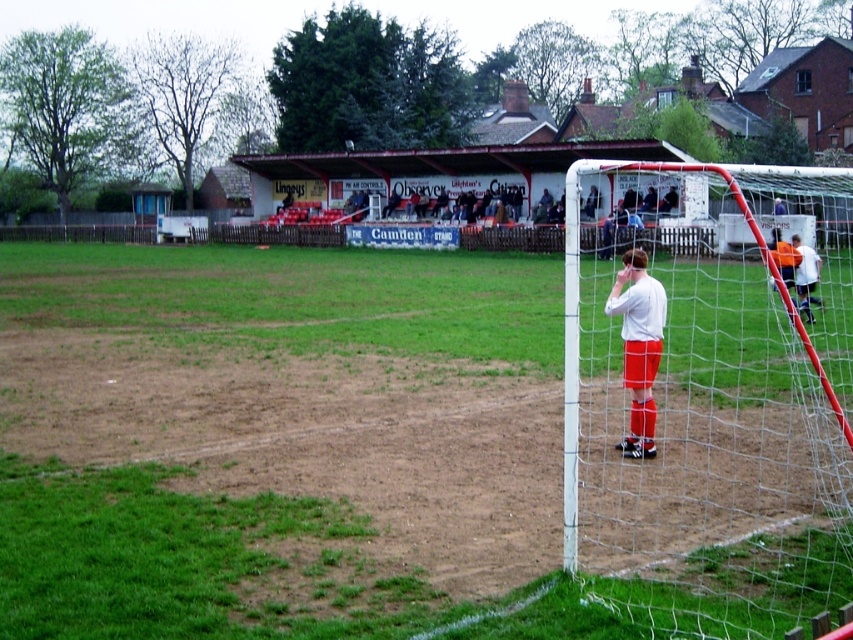
Question: Based on their relative distances, which object is farther from the green grass at lower left?

Choices:
 (A) white matte shirt at right
 (B) white mesh net at right

Answer: (A)

Question: Based on their relative distances, which object is nearer to the white mesh net at right?

Choices:
 (A) white matte shirt at right
 (B) green grass at lower left

Answer: (B)

Question: Which object is farther from the camera taking this photo?

Choices:
 (A) green grass at lower left
 (B) white mesh net at right
 (C) white matte shirt at right

Answer: (C)

Question: Is green grass at lower left thinner than white matte shirt at right?

Choices:
 (A) no
 (B) yes

Answer: (A)

Question: Is green grass at lower left thinner than white mesh net at right?

Choices:
 (A) yes
 (B) no

Answer: (B)

Question: Is green grass at lower left further to the viewer compared to white matte shirt at right?

Choices:
 (A) yes
 (B) no

Answer: (B)